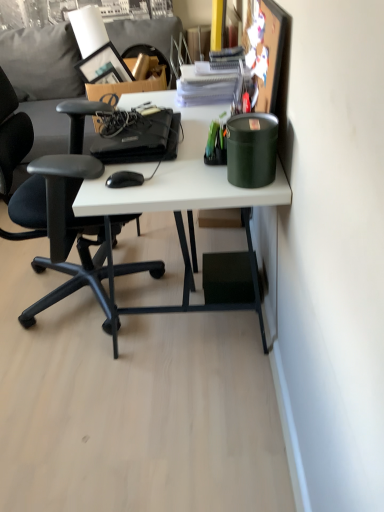
Question: Is green matte canister at upper right surrounded by black plastic mouse at center?

Choices:
 (A) no
 (B) yes

Answer: (A)

Question: From the image's perspective, is black plastic mouse at center below green matte canister at upper right?

Choices:
 (A) no
 (B) yes

Answer: (B)

Question: From a real-world perspective, is black plastic mouse at center over green matte canister at upper right?

Choices:
 (A) yes
 (B) no

Answer: (B)

Question: From the image's perspective, is black plastic mouse at center on green matte canister at upper right?

Choices:
 (A) yes
 (B) no

Answer: (B)

Question: From a real-world perspective, is black plastic mouse at center positioned under green matte canister at upper right based on gravity?

Choices:
 (A) no
 (B) yes

Answer: (B)

Question: Considering their positions, is black plastic mouse at center located in front of or behind green matte canister at upper right?

Choices:
 (A) behind
 (B) front

Answer: (A)

Question: From a real-world perspective, is black plastic mouse at center above or below green matte canister at upper right?

Choices:
 (A) below
 (B) above

Answer: (A)

Question: Is black plastic mouse at center taller or shorter than green matte canister at upper right?

Choices:
 (A) tall
 (B) short

Answer: (B)

Question: Considering the positions of black plastic mouse at center and green matte canister at upper right in the image, is black plastic mouse at center bigger or smaller than green matte canister at upper right?

Choices:
 (A) big
 (B) small

Answer: (B)

Question: From the image's perspective, is black matte laptop at center positioned above or below white matte desk at center?

Choices:
 (A) below
 (B) above

Answer: (B)

Question: Do you think black matte laptop at center is within white matte desk at center, or outside of it?

Choices:
 (A) outside
 (B) inside

Answer: (A)

Question: Is black matte laptop at center taller or shorter than white matte desk at center?

Choices:
 (A) tall
 (B) short

Answer: (B)

Question: Is black matte laptop at center to the left or to the right of white matte desk at center in the image?

Choices:
 (A) right
 (B) left

Answer: (B)

Question: Do you think black matte laptop at center is within black plastic mouse at center, or outside of it?

Choices:
 (A) outside
 (B) inside

Answer: (A)

Question: Considering the positions of point (150, 125) and point (127, 175), is point (150, 125) closer or farther from the camera than point (127, 175)?

Choices:
 (A) farther
 (B) closer

Answer: (A)